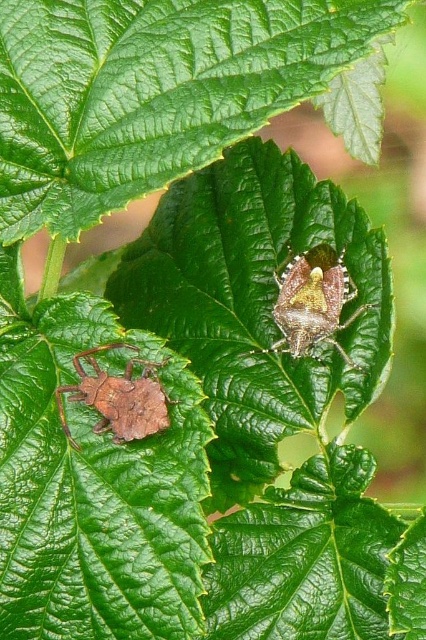
Is shiny brown bug at center bigger than matte brown bug at lower left?

Yes, shiny brown bug at center is bigger than matte brown bug at lower left.

Does shiny brown bug at center appear on the left side of matte brown bug at lower left?

In fact, shiny brown bug at center is to the right of matte brown bug at lower left.

Who is more distant from viewer, (x=282, y=312) or (x=163, y=390)?

Positioned behind is point (x=282, y=312).

The width and height of the screenshot is (426, 640). I want to click on shiny brown bug at center, so click(x=313, y=301).